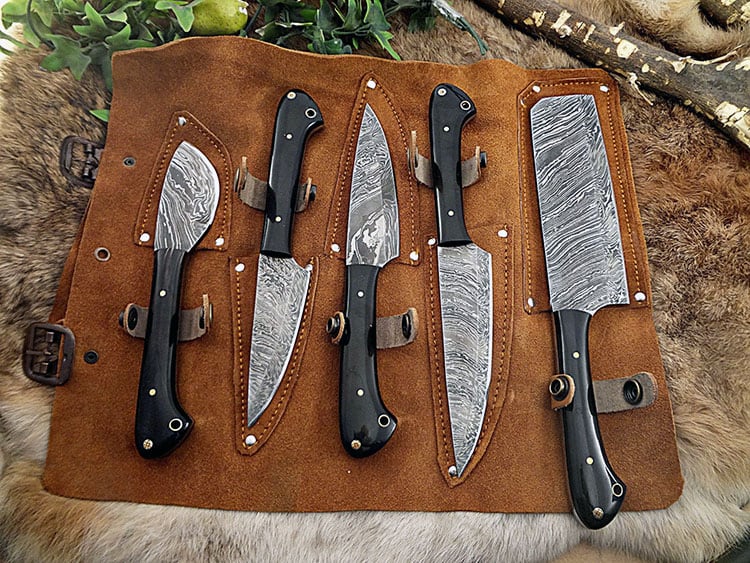
At what (x,y) coordinates should I click in order to perform the action: click on knives. Please return your answer as a coordinate pair (x, y). This screenshot has height=563, width=750. Looking at the image, I should click on (175, 232), (274, 291), (355, 284), (460, 274), (566, 259).